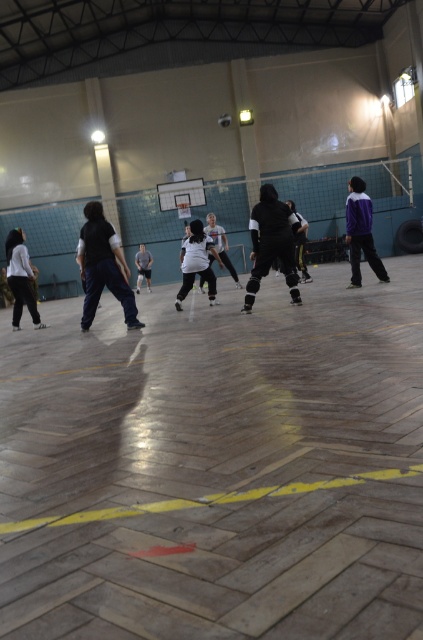
Can you confirm if matte black pants at center is positioned to the right of white matte shirt at center?

Yes, matte black pants at center is to the right of white matte shirt at center.

The width and height of the screenshot is (423, 640). I want to click on matte black pants at center, so click(x=197, y=262).

Between black matte jacket at center and white matte shirt at center, which one appears on the right side from the viewer's perspective?

black matte jacket at center

Is black matte jacket at center bigger than white matte shirt at center?

Incorrect, black matte jacket at center is not larger than white matte shirt at center.

Describe the element at coordinates (299, 243) in the screenshot. I see `black matte jacket at center` at that location.

Image resolution: width=423 pixels, height=640 pixels. What are the coordinates of `black matte jacket at center` in the screenshot? It's located at (x=299, y=243).

Based on the photo, which is below, purple matte jacket at right or white matte shirt at center?

purple matte jacket at right is below.

Which of these two, purple matte jacket at right or white matte shirt at center, stands shorter?

Standing shorter between the two is white matte shirt at center.

Locate an element on the screen. The height and width of the screenshot is (640, 423). purple matte jacket at right is located at coordinates (360, 232).

The width and height of the screenshot is (423, 640). Find the location of `purple matte jacket at right`. purple matte jacket at right is located at coordinates (360, 232).